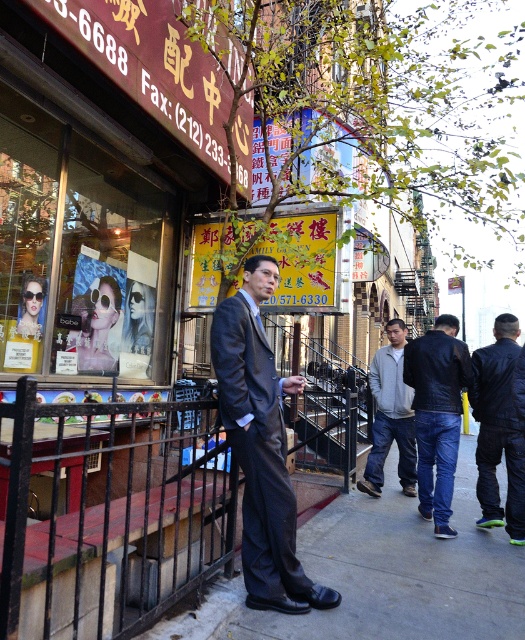
You are a photographer standing in front of the concrete sidewalk at center and the shiny brown suit at center. You want to take a photo that includes both objects in focus. Which object should you focus on to ensure both are sharp?

You should focus on the shiny brown suit at center because it is farther away from the viewer than the concrete sidewalk at center. By focusing on the farther object, the near object will also be in focus due to the depth of field.

You are a delivery person who needs to place a package on the concrete sidewalk at center. Can you confirm if the shiny brown suit at center is tall enough to block the package from being seen from above?

The concrete sidewalk at center has a lesser height compared to shiny brown suit at center, so the shiny brown suit at center is taller and would block the package from being seen from above.